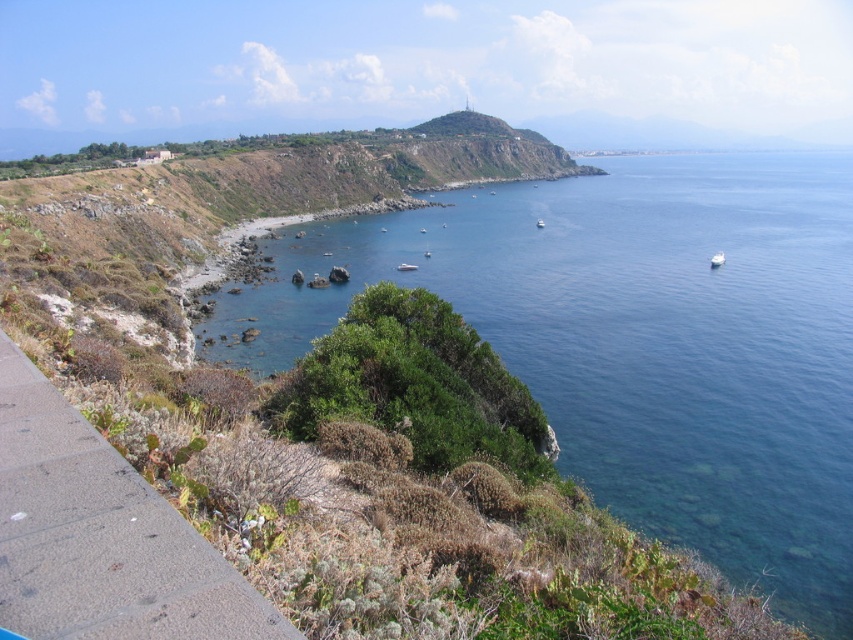
Does blue clear water at center lie behind white glossy boat at lower right?

No, blue clear water at center is closer to the viewer.

At what (x,y) coordinates should I click in order to perform the action: click on blue clear water at center. Please return your answer as a coordinate pair (x, y). This screenshot has width=853, height=640. Looking at the image, I should click on (641, 340).

In order to click on blue clear water at center in this screenshot , I will do `click(641, 340)`.

Which is behind, point (729, 381) or point (252, 621)?

The point (729, 381) is behind.

Is blue clear water at center further to camera compared to gray concrete sidewalk at lower left?

Yes.

Is point (570, 310) positioned behind point (236, 579)?

Yes, it is behind point (236, 579).

Where is `blue clear water at center`? The width and height of the screenshot is (853, 640). blue clear water at center is located at coordinates (641, 340).

Looking at this image, does blue clear water at center have a smaller size compared to white glossy boat at center?

No, blue clear water at center is not smaller than white glossy boat at center.

Is the position of blue clear water at center less distant than that of white glossy boat at center?

Yes, blue clear water at center is closer to the viewer.

Who is more distant from viewer, [363,220] or [415,266]?

Positioned behind is point [363,220].

Locate an element on the screen. blue clear water at center is located at coordinates (641, 340).